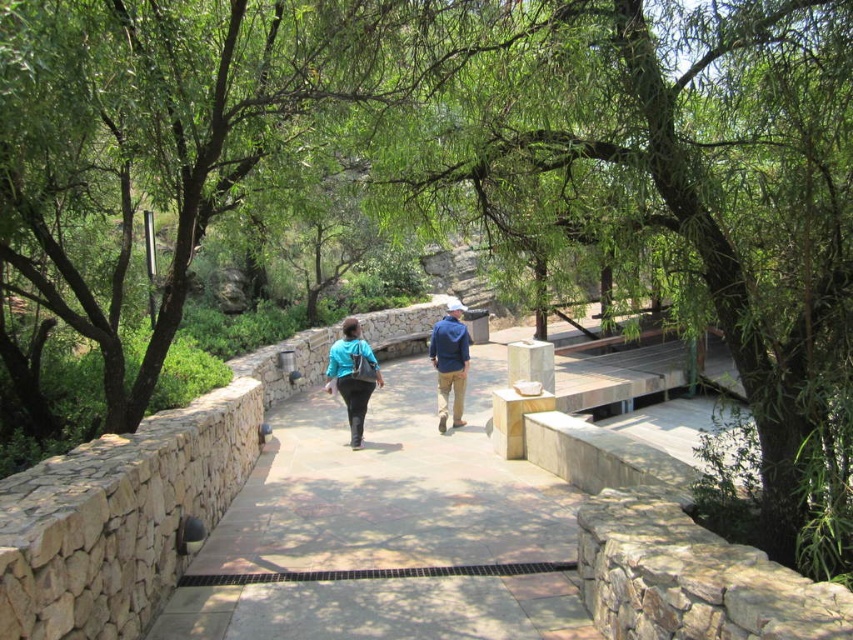
Which of these two, brown stone path at center or matte blue jacket at center, stands taller?

matte blue jacket at center

Who is positioned more to the left, brown stone path at center or matte blue jacket at center?

From the viewer's perspective, matte blue jacket at center appears more on the left side.

You are a GUI agent. You are given a task and a screenshot of the screen. Output one action in this format:
    pyautogui.click(x=<x>, y=<y>)
    Task: Click on the brown stone path at center
    This screenshot has width=853, height=640.
    Given the screenshot: What is the action you would take?
    pyautogui.click(x=386, y=531)

Between green leafy tree at center and blue denim jacket at center, which one has less height?

Standing shorter between the two is blue denim jacket at center.

Is point (602, 227) positioned behind point (445, 371)?

No, it is in front of (445, 371).

Describe the element at coordinates (686, 193) in the screenshot. This screenshot has height=640, width=853. I see `green leafy tree at center` at that location.

At what (x,y) coordinates should I click in order to perform the action: click on green leafy tree at center. Please return your answer as a coordinate pair (x, y). Image resolution: width=853 pixels, height=640 pixels. Looking at the image, I should click on (686, 193).

This screenshot has height=640, width=853. In order to click on blue fabric jacket at center in this screenshot , I will do `click(352, 376)`.

Who is more forward, [329,392] or [364,340]?

Positioned in front is point [329,392].

Who is more distant from viewer, (355, 349) or (358, 394)?

The point (358, 394) is more distant.

Identify the location of blue fabric jacket at center. This screenshot has width=853, height=640. [x=352, y=376].